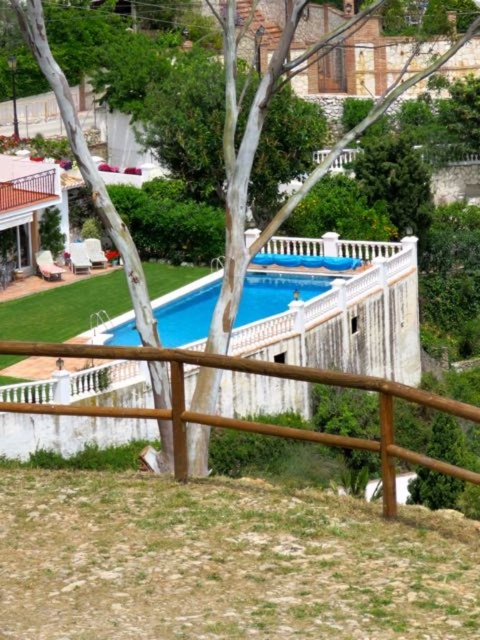
Question: Can you confirm if brown wooden fence at center is thinner than blue smooth pool at center?

Choices:
 (A) no
 (B) yes

Answer: (A)

Question: Does brown wooden fence at center come behind blue smooth pool at center?

Choices:
 (A) no
 (B) yes

Answer: (A)

Question: Among these points, which one is farthest from the camera?

Choices:
 (A) (273, 371)
 (B) (170, 316)

Answer: (B)

Question: Among these objects, which one is farthest from the camera?

Choices:
 (A) blue smooth pool at center
 (B) brown wooden fence at center

Answer: (A)

Question: Can you confirm if brown wooden fence at center is bigger than blue smooth pool at center?

Choices:
 (A) no
 (B) yes

Answer: (B)

Question: Which point is closer to the camera taking this photo?

Choices:
 (A) (296, 276)
 (B) (466, 406)

Answer: (B)